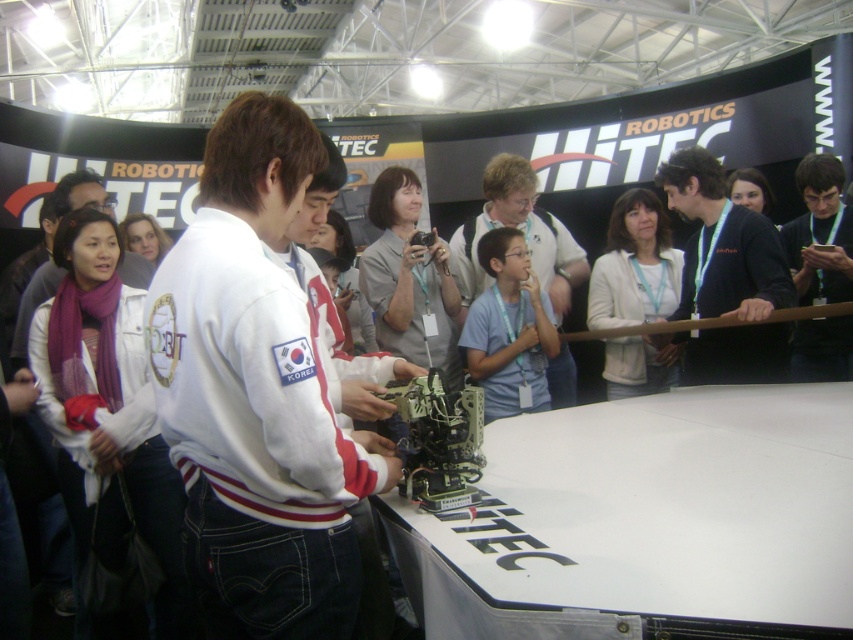
Question: Which point is farther from the camera taking this photo?

Choices:
 (A) (550, 237)
 (B) (190, 333)

Answer: (A)

Question: From the image, what is the correct spatial relationship of white fleece jacket at center in relation to white cotton jacket at center?

Choices:
 (A) right
 (B) left

Answer: (A)

Question: Can you confirm if black fabric at center is positioned below white cotton jacket at center?

Choices:
 (A) no
 (B) yes

Answer: (A)

Question: Considering the real-world distances, which object is farthest from the white cotton jacket at center?

Choices:
 (A) white fleece jacket at center
 (B) black fabric at center

Answer: (B)

Question: Which of these objects is positioned farthest from the white cotton jacket at center?

Choices:
 (A) light blue shirt at center
 (B) black fabric at center

Answer: (B)

Question: From the image, what is the correct spatial relationship of black fabric at center in relation to black matte shirt at upper right?

Choices:
 (A) left
 (B) right

Answer: (A)